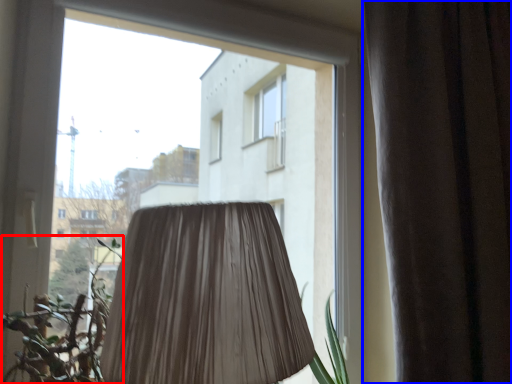
Question: Which point is further to the camera, vegetation (highlighted by a red box) or curtain (highlighted by a blue box)?

Choices:
 (A) vegetation
 (B) curtain

Answer: (B)